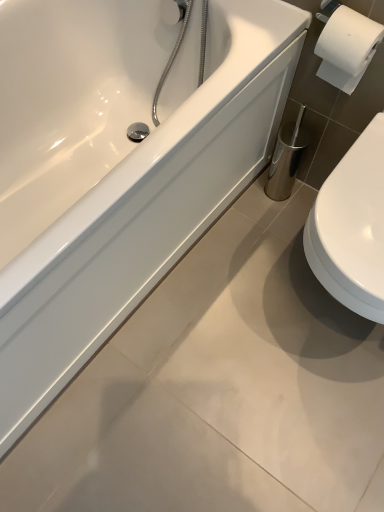
What do you see at coordinates (118, 165) in the screenshot? I see `white glossy bathtub at upper left` at bounding box center [118, 165].

Where is `white glossy bathtub at upper left`? The width and height of the screenshot is (384, 512). white glossy bathtub at upper left is located at coordinates (118, 165).

I want to click on white glossy bathtub at upper left, so click(118, 165).